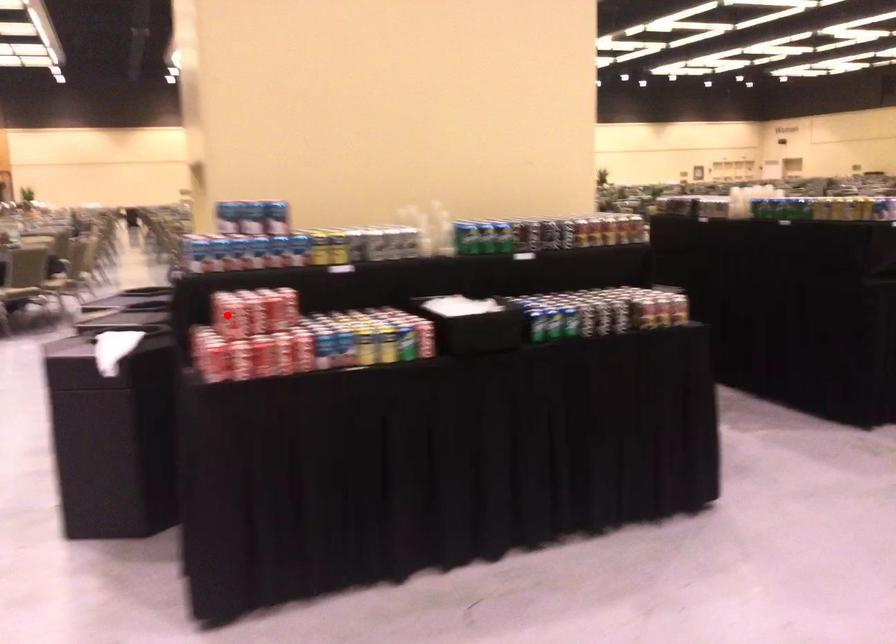
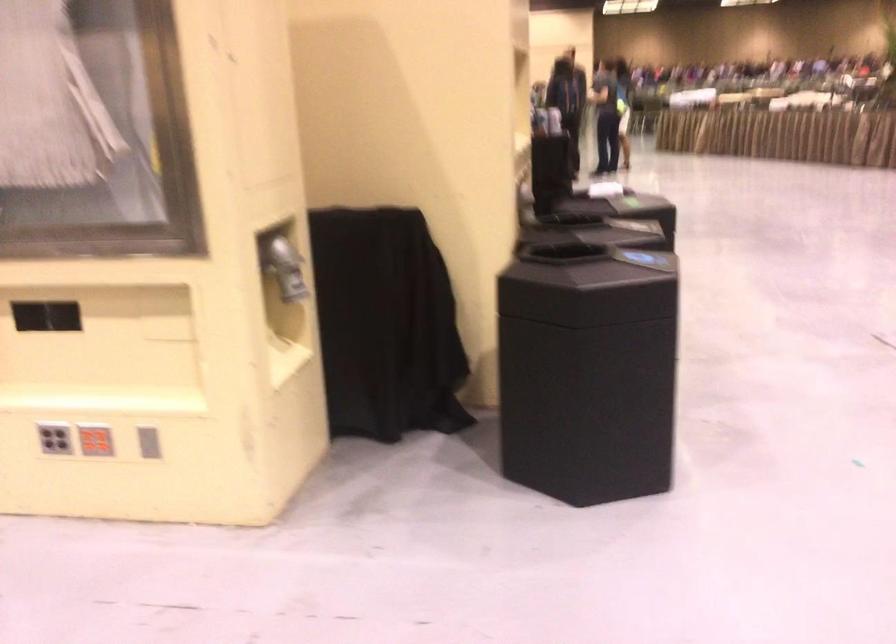
Question: I am providing you with two images of the same scene from different viewpoints. A red point is marked on the first image. Is the red point's position out of view in image 2?

Choices:
 (A) Yes
 (B) No

Answer: (A)